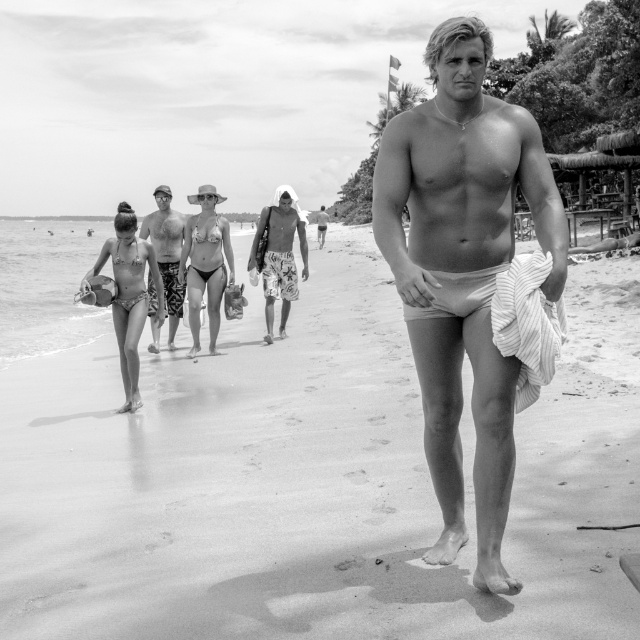
Question: Which object appears closest to the camera in this image?

Choices:
 (A) matte bikini at left
 (B) smooth sand at center
 (C) white matte shorts at center

Answer: (C)

Question: Can you confirm if smooth sand at center is bigger than matte bikini at left?

Choices:
 (A) no
 (B) yes

Answer: (B)

Question: Does matte bikini at left have a lesser width compared to patterned swim trunks at center?

Choices:
 (A) no
 (B) yes

Answer: (B)

Question: Among these objects, which one is nearest to the camera?

Choices:
 (A) patterned swim trunks at center
 (B) matte bikini at left

Answer: (B)

Question: Which of the following is the farthest from the observer?

Choices:
 (A) matte bikini at left
 (B) smooth sand at center
 (C) white matte shorts at center

Answer: (A)

Question: Can you confirm if smooth sand at center is positioned below white matte shorts at center?

Choices:
 (A) no
 (B) yes

Answer: (B)